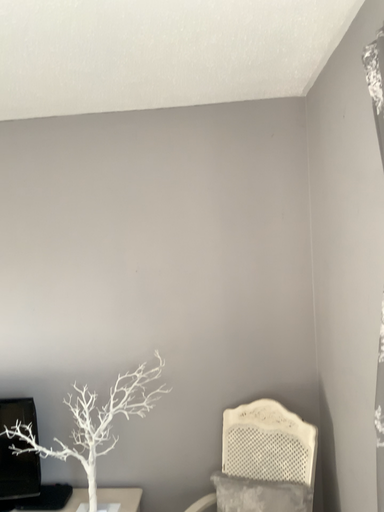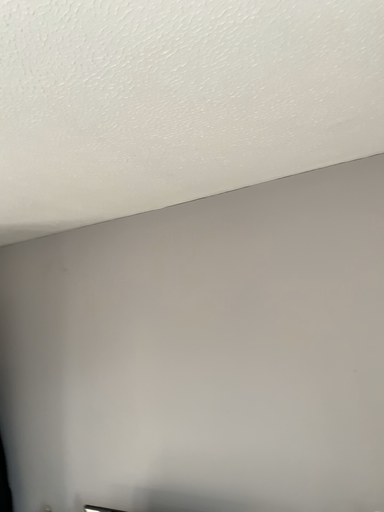
Question: How did the camera likely rotate when shooting the video?

Choices:
 (A) rotated downward
 (B) rotated upward

Answer: (B)